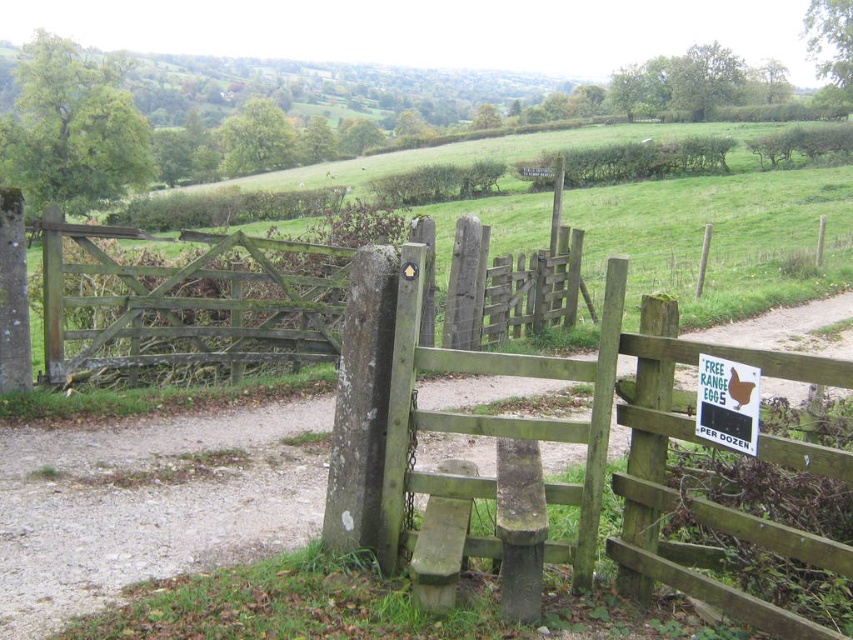
Question: Among these points, which one is nearest to the camera?

Choices:
 (A) (474, 308)
 (B) (698, 397)

Answer: (B)

Question: Observing the image, what is the correct spatial positioning of green mossy wood gate at center in reference to green plastic sign at center?

Choices:
 (A) above
 (B) below

Answer: (A)

Question: Does green mossy wood gate at center appear under green plastic sign at center?

Choices:
 (A) no
 (B) yes

Answer: (A)

Question: Which point is closer to the camera?

Choices:
 (A) green plastic sign at center
 (B) green mossy wood gate at center

Answer: (A)

Question: Does green mossy wood gate at center appear on the right side of green plastic sign at center?

Choices:
 (A) yes
 (B) no

Answer: (B)